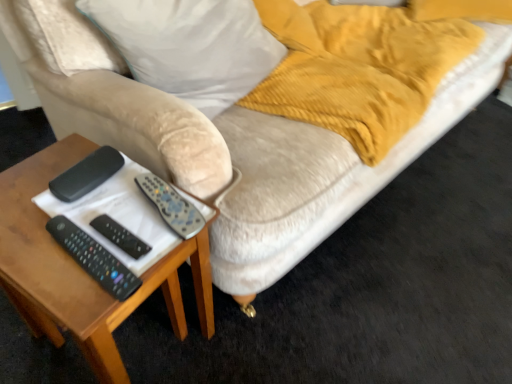
Measure the distance between point (79, 164) and camera.

Point (79, 164) and camera are 36.50 inches apart.

Measure the distance between black plastic remote at lower left, the first remote from the bottom, and camera.

The depth of black plastic remote at lower left, the first remote from the bottom, is 27.23 inches.

Locate an element on the screen. black plastic remote at lower left, which appears as the third remote when viewed from the top is located at coordinates (94, 258).

The height and width of the screenshot is (384, 512). I want to click on white fabric pillow at upper left, so click(190, 46).

The width and height of the screenshot is (512, 384). In order to click on silver metallic remote at center, the first remote when ordered from top to bottom in this screenshot , I will do `click(170, 206)`.

Is black plastic remote at center, arranged as the 2th remote when ordered from the bottom, outside of black plastic remote at lower left, which appears as the third remote when viewed from the top?

Absolutely, black plastic remote at center, arranged as the 2th remote when ordered from the bottom, is external to black plastic remote at lower left, which appears as the third remote when viewed from the top.

How many degrees apart are the facing directions of black plastic remote at center, positioned as the second remote in top-to-bottom order, and black plastic remote at lower left, the first remote from the bottom?

0.577 degrees.

Where is `remote directly beneath the black plastic remote at lower left, the first remote from the bottom (from a real-world perspective)`? Image resolution: width=512 pixels, height=384 pixels. remote directly beneath the black plastic remote at lower left, the first remote from the bottom (from a real-world perspective) is located at coordinates (120, 236).

Is black plastic remote at center, positioned as the second remote in top-to-bottom order, placed right next to black plastic remote at lower left, which appears as the third remote when viewed from the top?

Yes, black plastic remote at center, positioned as the second remote in top-to-bottom order, is touching black plastic remote at lower left, which appears as the third remote when viewed from the top.

Is point (154, 195) in front of point (263, 68)?

Yes, point (154, 195) is closer to viewer.

From the image's perspective, count 1st remotes downward from the white fabric pillow at upper left and point to it. Please provide its 2D coordinates.

[(170, 206)]

Is white fabric pillow at upper left a part of silver metallic remote at center, the third remote positioned from the bottom?

Actually, white fabric pillow at upper left is outside silver metallic remote at center, the third remote positioned from the bottom.

From the picture: Is silver metallic remote at center, the first remote when ordered from top to bottom, to the left of wooden table at lower left from the viewer's perspective?

Incorrect, silver metallic remote at center, the first remote when ordered from top to bottom, is not on the left side of wooden table at lower left.

Image resolution: width=512 pixels, height=384 pixels. What are the coordinates of `table on the left of silver metallic remote at center, the third remote positioned from the bottom` in the screenshot? It's located at (82, 270).

Is silver metallic remote at center, the third remote positioned from the bottom, next to wooden table at lower left and touching it?

No, silver metallic remote at center, the third remote positioned from the bottom, is not with wooden table at lower left.

Is silver metallic remote at center, the first remote when ordered from top to bottom, taller or shorter than wooden table at lower left?

Considering their sizes, silver metallic remote at center, the first remote when ordered from top to bottom, has less height than wooden table at lower left.

How far apart are silver metallic remote at center, the third remote positioned from the bottom, and black plastic remote control at left?

silver metallic remote at center, the third remote positioned from the bottom, is 5.62 inches away from black plastic remote control at left.

Which object is further away from the camera taking this photo, silver metallic remote at center, the first remote when ordered from top to bottom, or black plastic remote control at left?

black plastic remote control at left is behind.

Based on the photo, between silver metallic remote at center, the first remote when ordered from top to bottom, and black plastic remote control at left, which one has less height?

Standing shorter between the two is silver metallic remote at center, the first remote when ordered from top to bottom.

In the image, there is a silver metallic remote at center, the third remote positioned from the bottom. Where is `gadget above it (from the image's perspective)`? The image size is (512, 384). gadget above it (from the image's perspective) is located at coordinates (87, 174).

Considering the relative positions of black plastic remote at lower left, the first remote from the bottom, and wooden table at lower left in the image provided, is black plastic remote at lower left, the first remote from the bottom, to the right of wooden table at lower left from the viewer's perspective?

Yes, black plastic remote at lower left, the first remote from the bottom, is to the right of wooden table at lower left.

Considering the points (67, 250) and (161, 270), which point is behind, point (67, 250) or point (161, 270)?

The point (161, 270) is farther.

Is black plastic remote at lower left, which appears as the third remote when viewed from the top, turned away from wooden table at lower left?

That's not correct — black plastic remote at lower left, which appears as the third remote when viewed from the top, is not looking away from wooden table at lower left.

Is black plastic remote at lower left, which appears as the third remote when viewed from the top, shorter than wooden table at lower left?

Indeed, black plastic remote at lower left, which appears as the third remote when viewed from the top, has a lesser height compared to wooden table at lower left.

Between black plastic remote control at left and wooden table at lower left, which one has smaller width?

Thinner between the two is black plastic remote control at left.

From the image's perspective, which is above, black plastic remote control at left or wooden table at lower left?

black plastic remote control at left is shown above in the image.

From a real-world perspective, is black plastic remote control at left located beneath wooden table at lower left?

No, from a real-world perspective, black plastic remote control at left is not beneath wooden table at lower left.

Which is closer to the camera, (99,164) or (34,313)?

Clearly, point (99,164) is closer to the camera than point (34,313).

Is silver metallic remote at center, the third remote positioned from the bottom, facing towards black plastic remote at center, arranged as the 2th remote when ordered from the bottom?

No, silver metallic remote at center, the third remote positioned from the bottom, is not oriented towards black plastic remote at center, arranged as the 2th remote when ordered from the bottom.

Find the location of a particular element. This screenshot has width=512, height=384. remote lying above the black plastic remote at center, arranged as the 2th remote when ordered from the bottom (from the image's perspective) is located at coordinates (170, 206).

Does silver metallic remote at center, the third remote positioned from the bottom, have a smaller size compared to black plastic remote at center, positioned as the second remote in top-to-bottom order?

Actually, silver metallic remote at center, the third remote positioned from the bottom, might be larger than black plastic remote at center, positioned as the second remote in top-to-bottom order.

How many degrees apart are the facing directions of silver metallic remote at center, the third remote positioned from the bottom, and black plastic remote at center, arranged as the 2th remote when ordered from the bottom?

The angular difference between silver metallic remote at center, the third remote positioned from the bottom, and black plastic remote at center, arranged as the 2th remote when ordered from the bottom, is 14.9 degrees.

Find the location of a particular element. The image size is (512, 384). the 1st remote behind the black plastic remote at lower left, the first remote from the bottom, starting your count from the anchor is located at coordinates (120, 236).

Find the location of a particular element. This screenshot has height=384, width=512. the 1st remote below when counting from the white fabric pillow at upper left (from the image's perspective) is located at coordinates pyautogui.click(x=170, y=206).

In the scene shown: When comparing their distances from black plastic remote control at left, does white fabric pillow at upper left or wooden table at lower left seem further?

Among the two, white fabric pillow at upper left is located further to black plastic remote control at left.

When comparing their distances from black plastic remote at lower left, which appears as the third remote when viewed from the top, does wooden table at lower left or black plastic remote control at left seem closer?

black plastic remote control at left is positioned closer to the anchor black plastic remote at lower left, which appears as the third remote when viewed from the top.

Based on their spatial positions, is black plastic remote at lower left, which appears as the third remote when viewed from the top, or silver metallic remote at center, the first remote when ordered from top to bottom, further from wooden table at lower left?

silver metallic remote at center, the first remote when ordered from top to bottom.

Estimate the real-world distances between objects in this image. Which object is closer to black plastic remote at lower left, the first remote from the bottom, wooden table at lower left or silver metallic remote at center, the third remote positioned from the bottom?

wooden table at lower left is closer to black plastic remote at lower left, the first remote from the bottom.

From the image, which object appears to be nearer to black plastic remote at center, arranged as the 2th remote when ordered from the bottom, white fabric pillow at upper left or wooden table at lower left?

wooden table at lower left lies closer to black plastic remote at center, arranged as the 2th remote when ordered from the bottom, than the other object.

Considering their positions, is silver metallic remote at center, the first remote when ordered from top to bottom, positioned further to wooden table at lower left than black plastic remote at lower left, the first remote from the bottom?

Based on the image, silver metallic remote at center, the first remote when ordered from top to bottom, appears to be further to wooden table at lower left.

When comparing their distances from white fabric pillow at upper left, does silver metallic remote at center, the third remote positioned from the bottom, or black plastic remote at lower left, which appears as the third remote when viewed from the top, seem closer?

Among the two, silver metallic remote at center, the third remote positioned from the bottom, is located nearer to white fabric pillow at upper left.

Estimate the real-world distances between objects in this image. Which object is further from white fabric pillow at upper left, wooden table at lower left or silver metallic remote at center, the third remote positioned from the bottom?

silver metallic remote at center, the third remote positioned from the bottom, lies further to white fabric pillow at upper left than the other object.

At what (x,y) coordinates should I click in order to perform the action: click on gadget between white fabric pillow at upper left and wooden table at lower left in the up-down direction. Please return your answer as a coordinate pair (x, y). The width and height of the screenshot is (512, 384). Looking at the image, I should click on (87, 174).

Find the location of a particular element. This screenshot has height=384, width=512. remote between black plastic remote at lower left, which appears as the third remote when viewed from the top, and silver metallic remote at center, the third remote positioned from the bottom, from left to right is located at coordinates pyautogui.click(x=120, y=236).

Identify the location of gadget between white fabric pillow at upper left and black plastic remote at lower left, which appears as the third remote when viewed from the top, in the up-down direction. The image size is (512, 384). (87, 174).

Find the location of `remote between white fabric pillow at upper left and black plastic remote at center, positioned as the second remote in top-to-bottom order, in the vertical direction`. remote between white fabric pillow at upper left and black plastic remote at center, positioned as the second remote in top-to-bottom order, in the vertical direction is located at coordinates (170, 206).